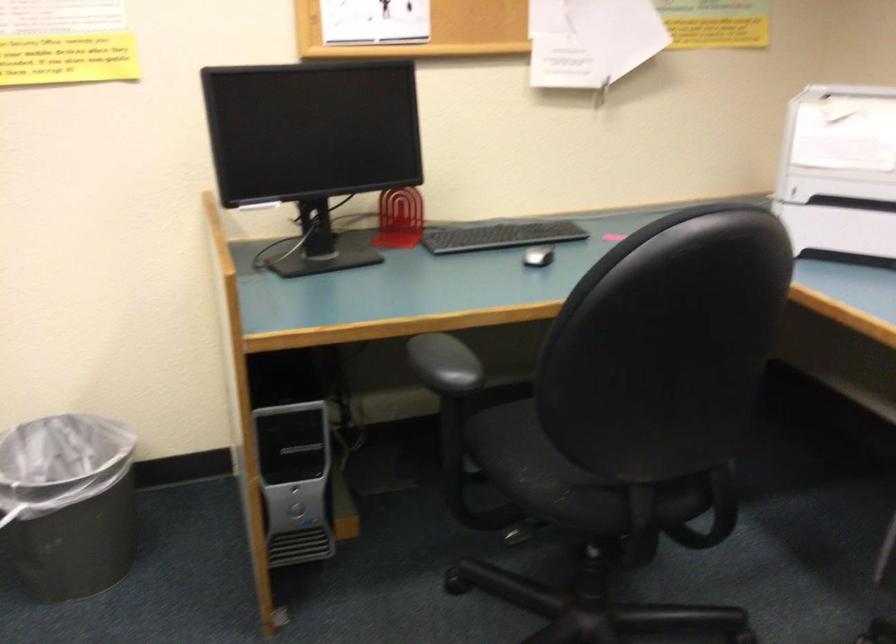
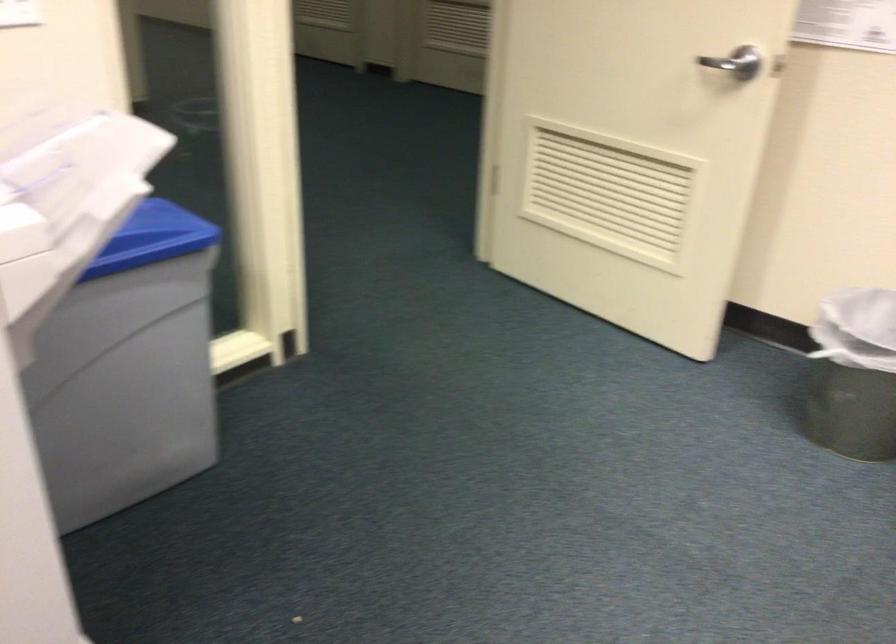
First-person continuous shooting, in which direction is the camera rotating?

The camera rotated toward left-down.